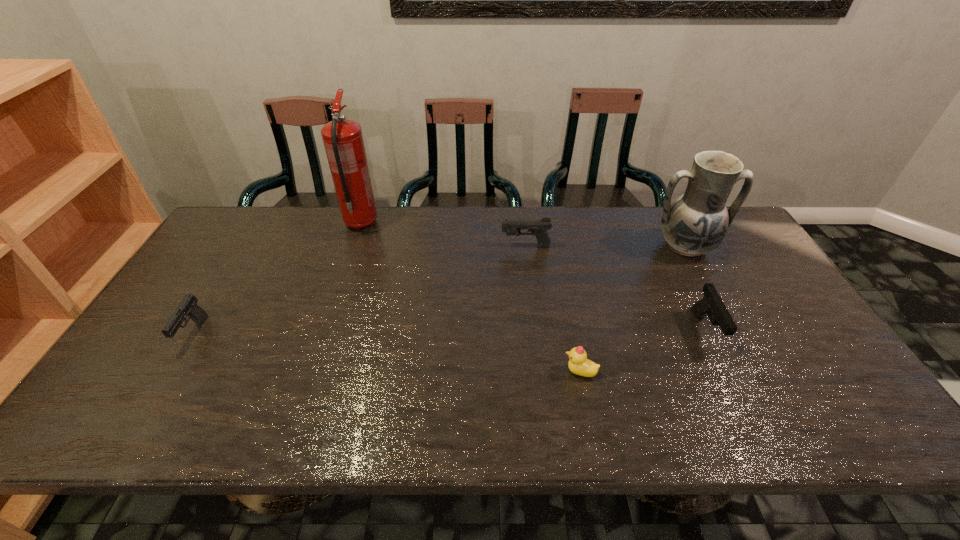
This screenshot has width=960, height=540. What are the coordinates of `object that stands as the third closest to the fifth shortest object` in the screenshot? It's located at (578, 364).

Choose which pistol is the third nearest neighbor to the fire extinguisher. Please provide its 2D coordinates. Your answer should be formatted as a tuple, i.e. [(x, y)], where the tuple contains the x and y coordinates of a point satisfying the conditions above.

[(711, 305)]

At what (x,y) coordinates should I click in order to perform the action: click on pistol that is the closest to the tallest object. Please return your answer as a coordinate pair (x, y). Looking at the image, I should click on (538, 227).

The image size is (960, 540). Find the location of `free space that satisfies the following two spatial constraints: 1. at the barrel of the farthest pistol; 2. aim along the barrel of the shortest pistol`. free space that satisfies the following two spatial constraints: 1. at the barrel of the farthest pistol; 2. aim along the barrel of the shortest pistol is located at coordinates (536, 334).

This screenshot has width=960, height=540. I want to click on free space that satisfies the following two spatial constraints: 1. on the front-facing side of the rightmost pistol; 2. on the front-facing side of the nearest object, so (x=726, y=372).